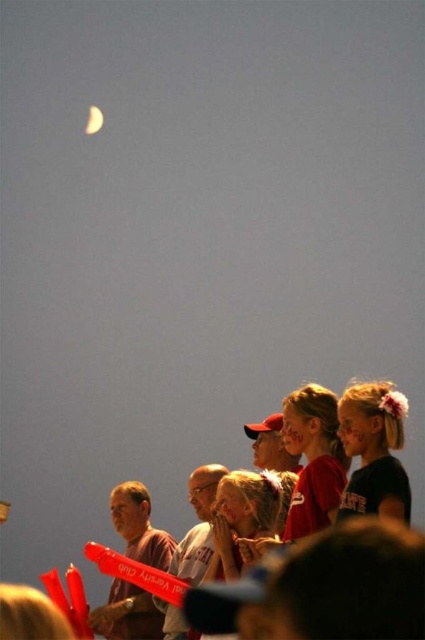
Question: Which object is farther from the camera taking this photo?

Choices:
 (A) matte red shirt at center
 (B) shiny metallic crescent at upper left
 (C) matte black shirt at lower right

Answer: (B)

Question: Which is nearer to the matte red shirt at center?

Choices:
 (A) shiny metallic crescent at upper left
 (B) matte black shirt at lower right

Answer: (B)

Question: Can you confirm if matte black shirt at lower right is positioned below shiny metallic crescent at upper left?

Choices:
 (A) yes
 (B) no

Answer: (A)

Question: Which point appears farthest from the camera in this image?

Choices:
 (A) (90, 106)
 (B) (365, 392)
 (C) (306, 452)

Answer: (A)

Question: Is matte red shirt at center to the left of shiny metallic crescent at upper left from the viewer's perspective?

Choices:
 (A) no
 (B) yes

Answer: (A)

Question: Does matte black shirt at lower right appear on the right side of shiny metallic crescent at upper left?

Choices:
 (A) no
 (B) yes

Answer: (B)